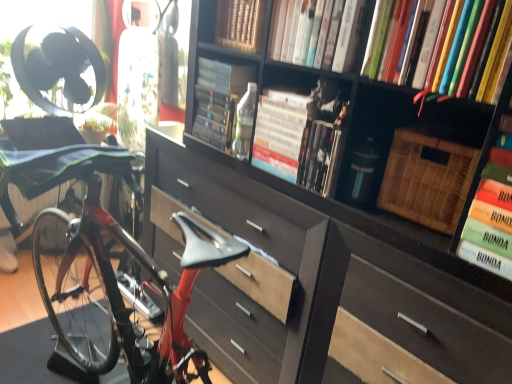
Question: Is hardcover books at upper right, which is the second book from right to left, bigger than green fabric swivel chair at left?

Choices:
 (A) no
 (B) yes

Answer: (B)

Question: Could you tell me if hardcover books at upper right, which is the second book from right to left, is facing green fabric swivel chair at left?

Choices:
 (A) no
 (B) yes

Answer: (A)

Question: Is hardcover books at upper right, which is the second book from right to left, shorter than green fabric swivel chair at left?

Choices:
 (A) yes
 (B) no

Answer: (B)

Question: Does hardcover books at upper right, which is the second book from right to left, appear on the right side of green fabric swivel chair at left?

Choices:
 (A) yes
 (B) no

Answer: (A)

Question: Does hardcover books at upper right, which is the second book from right to left, touch green fabric swivel chair at left?

Choices:
 (A) no
 (B) yes

Answer: (A)

Question: From a real-world perspective, is hardcover books at upper right, the 6th book in the left-to-right sequence, over green fabric swivel chair at left?

Choices:
 (A) no
 (B) yes

Answer: (B)

Question: Considering the relative sizes of green matte book at right, arranged as the seventh book when viewed from the left, and woven brown basket at upper right in the image provided, is green matte book at right, arranged as the seventh book when viewed from the left, taller than woven brown basket at upper right?

Choices:
 (A) yes
 (B) no

Answer: (A)

Question: From the image's perspective, is green matte book at right, arranged as the seventh book when viewed from the left, under woven brown basket at upper right?

Choices:
 (A) yes
 (B) no

Answer: (A)

Question: Is woven brown basket at upper right at the back of green matte book at right, arranged as the seventh book when viewed from the left?

Choices:
 (A) no
 (B) yes

Answer: (A)

Question: Does green matte book at right, arranged as the seventh book when viewed from the left, come in front of woven brown basket at upper right?

Choices:
 (A) no
 (B) yes

Answer: (B)

Question: Is green matte book at right, the 1th book viewed from the right, beside woven brown basket at upper right?

Choices:
 (A) yes
 (B) no

Answer: (B)

Question: Is green matte book at right, arranged as the seventh book when viewed from the left, further to the viewer compared to woven brown basket at upper right?

Choices:
 (A) no
 (B) yes

Answer: (A)

Question: Considering the relative positions of hardcover book at upper center, the fourth book when ordered from right to left, and green matte book at right, arranged as the seventh book when viewed from the left, in the image provided, is hardcover book at upper center, the fourth book when ordered from right to left, in front of green matte book at right, arranged as the seventh book when viewed from the left,?

Choices:
 (A) no
 (B) yes

Answer: (A)